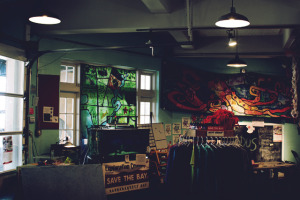
Identify the location of wall. (104, 54).